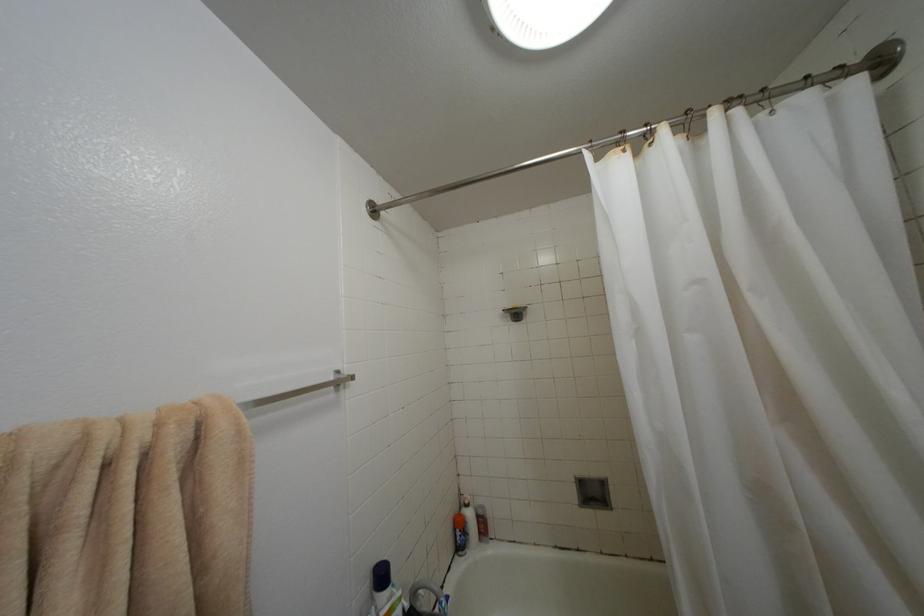
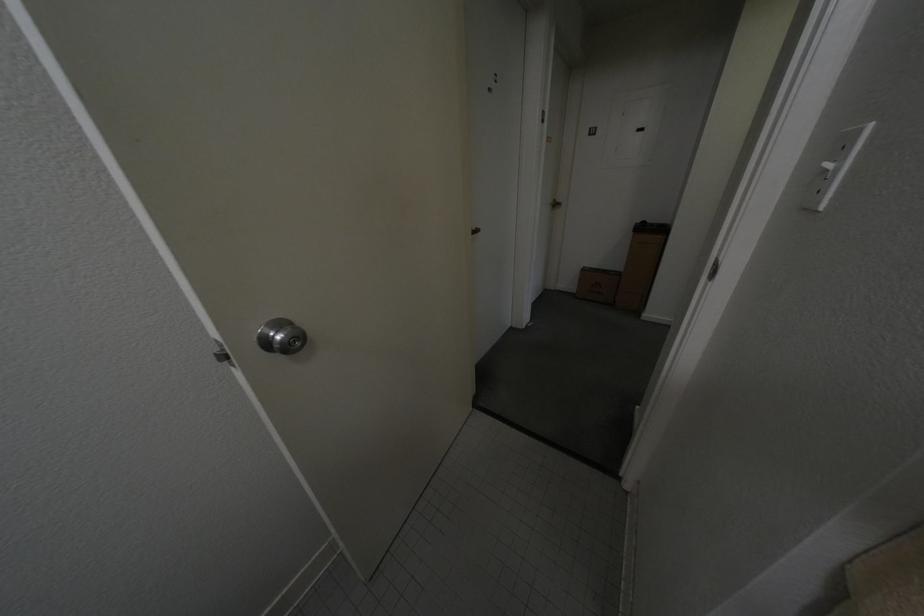
The first image is from the beginning of the video and the second image is from the end. How did the camera likely rotate when shooting the video?

The camera rotated toward left-down.